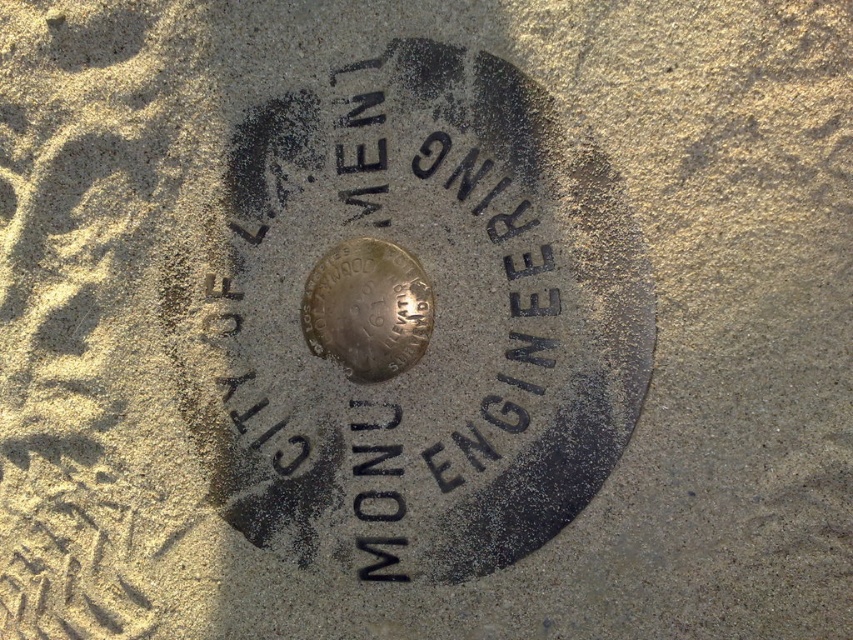
Question: Is black metal marker at center smaller than shiny metallic coin at center?

Choices:
 (A) no
 (B) yes

Answer: (A)

Question: Among these objects, which one is nearest to the camera?

Choices:
 (A) black metal marker at center
 (B) shiny metallic coin at center

Answer: (A)

Question: Does black metal marker at center come in front of shiny metallic coin at center?

Choices:
 (A) yes
 (B) no

Answer: (A)

Question: In this image, where is black metal marker at center located relative to shiny metallic coin at center?

Choices:
 (A) above
 (B) below

Answer: (A)

Question: Which point appears farthest from the camera in this image?

Choices:
 (A) (334, 474)
 (B) (408, 355)

Answer: (A)

Question: Which point is farther to the camera?

Choices:
 (A) (426, 320)
 (B) (297, 170)

Answer: (B)